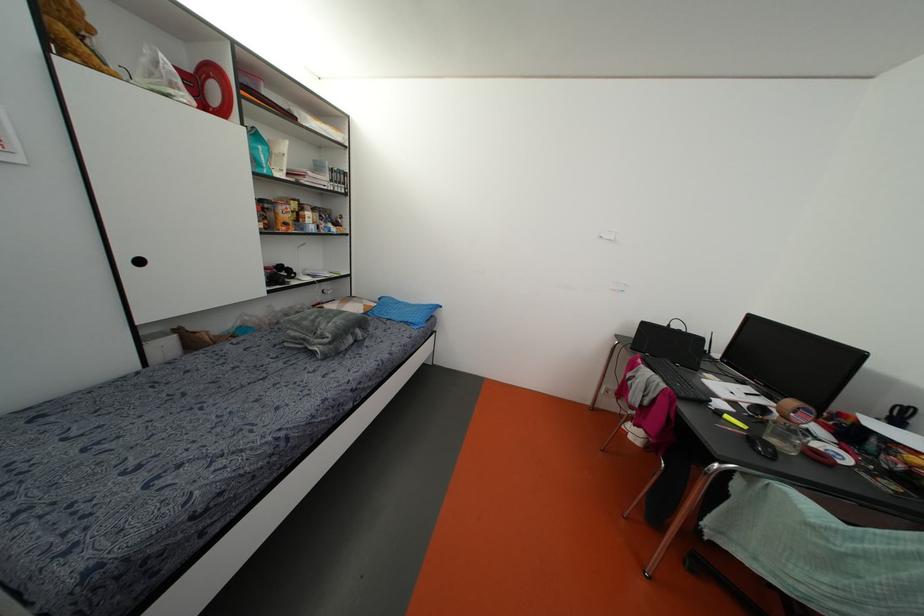
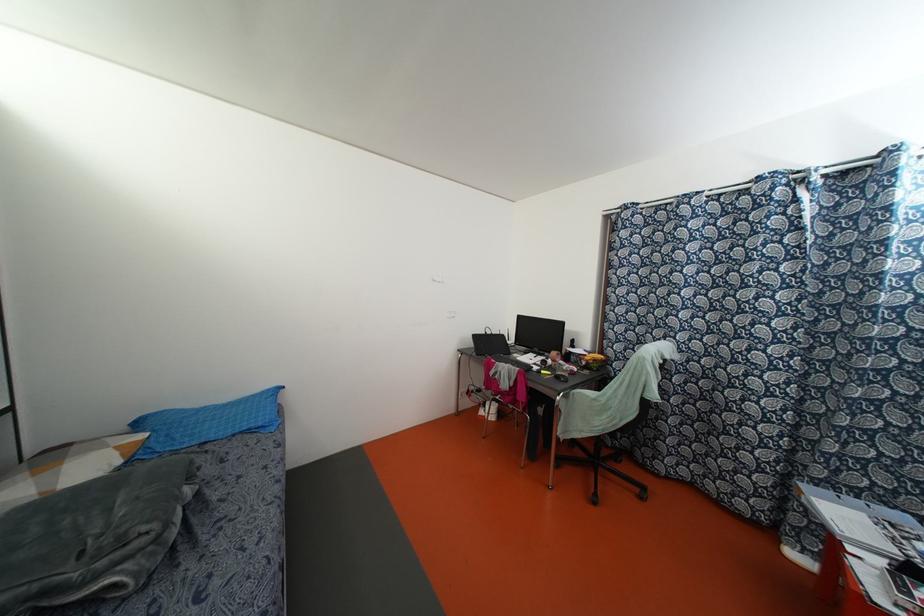
In the second image, find the point that corresponds to [643,323] in the first image.

(473, 336)